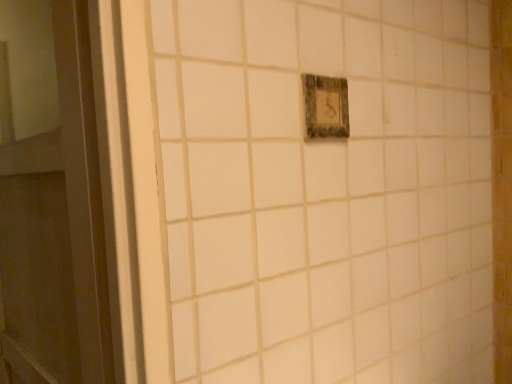
Question: Is rustic wood light switch at center bigger or smaller than white glossy door at left?

Choices:
 (A) big
 (B) small

Answer: (B)

Question: Based on their positions, is rustic wood light switch at center located to the left or right of white glossy door at left?

Choices:
 (A) right
 (B) left

Answer: (A)

Question: Would you say rustic wood light switch at center is inside or outside white glossy door at left?

Choices:
 (A) outside
 (B) inside

Answer: (A)

Question: From their relative heights in the image, would you say white glossy door at left is taller or shorter than rustic wood light switch at center?

Choices:
 (A) tall
 (B) short

Answer: (A)

Question: Is white glossy door at left bigger or smaller than rustic wood light switch at center?

Choices:
 (A) small
 (B) big

Answer: (B)

Question: Considering the positions of point (82, 64) and point (342, 137), is point (82, 64) closer or farther from the camera than point (342, 137)?

Choices:
 (A) closer
 (B) farther

Answer: (A)

Question: In the image, is white glossy door at left positioned in front of or behind rustic wood light switch at center?

Choices:
 (A) front
 (B) behind

Answer: (A)